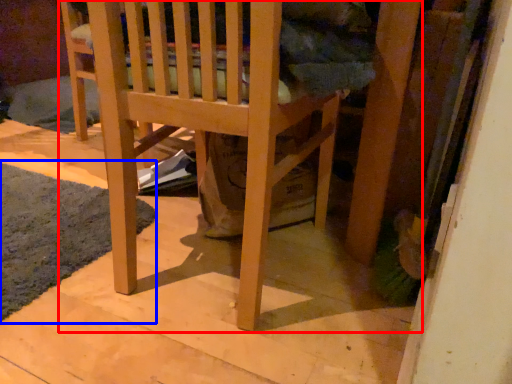
Question: Which object is closer to the camera taking this photo, furniture (highlighted by a red box) or mat (highlighted by a blue box)?

Choices:
 (A) furniture
 (B) mat

Answer: (A)